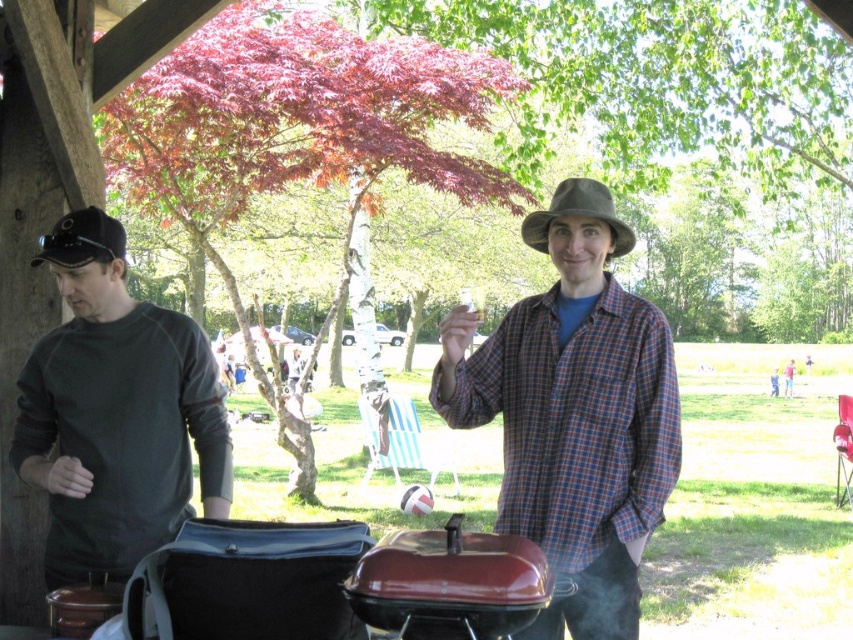
Question: Among these objects, which one is nearest to the camera?

Choices:
 (A) black matte fedora at left
 (B) brown felt fedora at center

Answer: (A)

Question: Which of the following is the farthest from the observer?

Choices:
 (A) black matte fedora at left
 (B) brown felt fedora at center
 (C) dark gray long-sleeve shirt at left

Answer: (B)

Question: Can you confirm if plaid fabric shirt at center is positioned to the left of dark gray long-sleeve shirt at left?

Choices:
 (A) yes
 (B) no

Answer: (B)

Question: Is black matte fedora at left wider than brown felt fedora at center?

Choices:
 (A) no
 (B) yes

Answer: (B)

Question: Does dark gray long-sleeve shirt at left come in front of brown felt fedora at center?

Choices:
 (A) yes
 (B) no

Answer: (A)

Question: Which is nearer to the brown felt fedora at center?

Choices:
 (A) dark gray long-sleeve shirt at left
 (B) plaid fabric shirt at center
 (C) black matte fedora at left

Answer: (B)